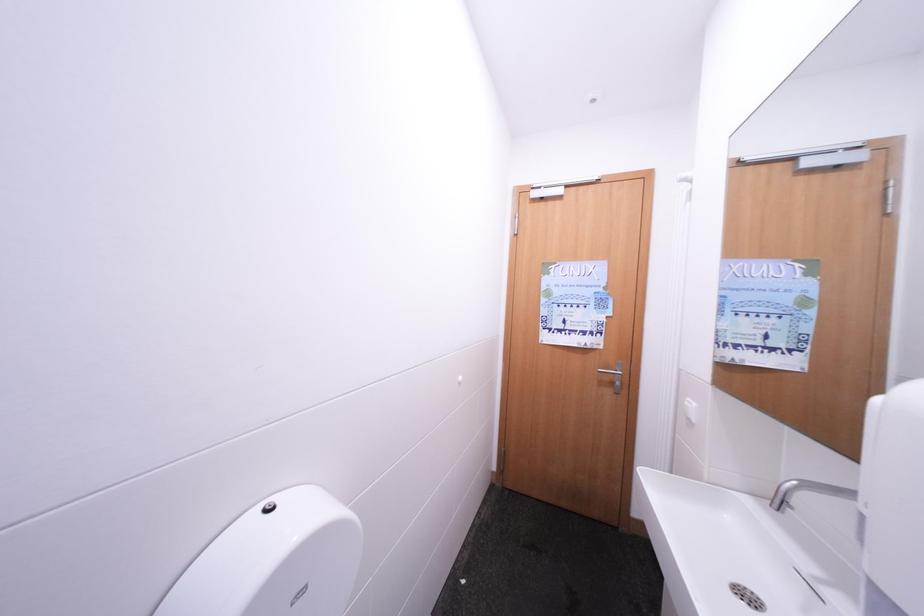
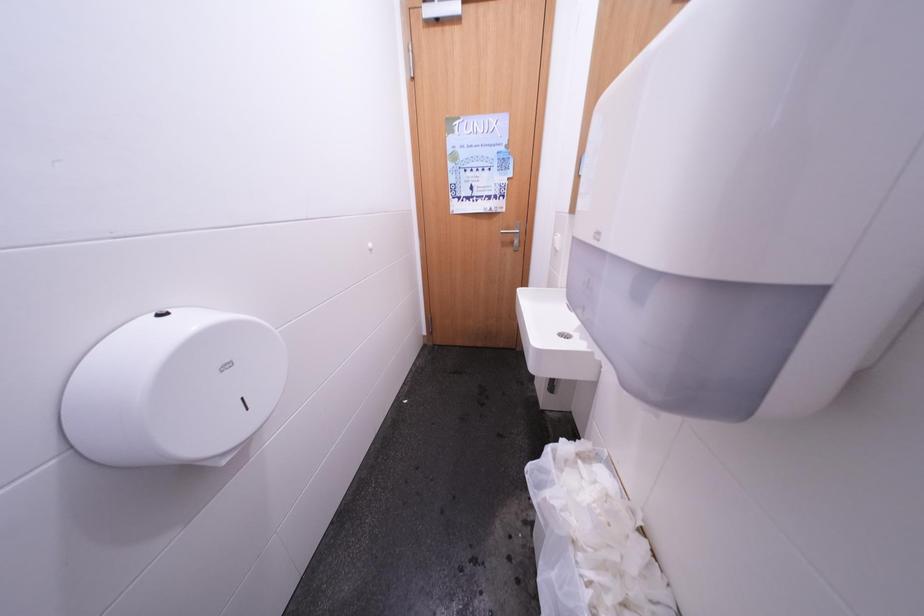
Question: The first image is from the beginning of the video and the second image is from the end. How did the camera likely rotate when shooting the video?

Choices:
 (A) Left
 (B) Right
 (C) Up
 (D) Down

Answer: (D)